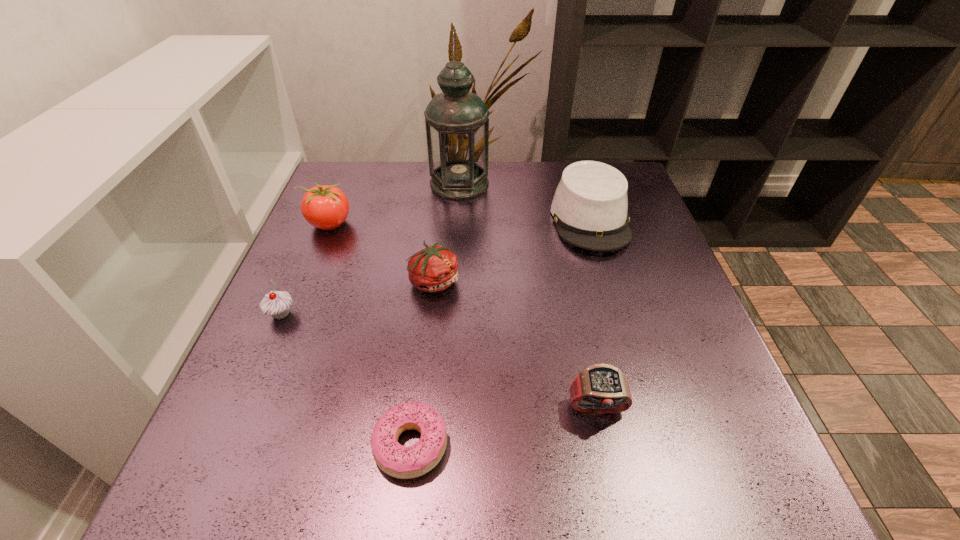
Where is `free space between the watch and the doughnut`? free space between the watch and the doughnut is located at coordinates (504, 427).

Where is `empty space between the doughnut and the nearer tomato`? Image resolution: width=960 pixels, height=540 pixels. empty space between the doughnut and the nearer tomato is located at coordinates (422, 363).

This screenshot has height=540, width=960. I want to click on free area in between the hat and the tallest object, so click(x=525, y=201).

Identify the location of empty space between the watch and the nearer tomato. The width and height of the screenshot is (960, 540). (516, 345).

Where is `free space between the tallest object and the fourth nearest object`? The width and height of the screenshot is (960, 540). free space between the tallest object and the fourth nearest object is located at coordinates (447, 232).

Identify the location of free area in between the hat and the tallest object. The image size is (960, 540). (525, 201).

Where is `free spot between the hat and the shortest object`? Image resolution: width=960 pixels, height=540 pixels. free spot between the hat and the shortest object is located at coordinates (500, 332).

The height and width of the screenshot is (540, 960). Find the location of `object that can be found as the third closest to the farther tomato`. object that can be found as the third closest to the farther tomato is located at coordinates (277, 304).

Find the location of a particular element. object that is the fifth closest to the hat is located at coordinates (326, 207).

I want to click on vacant region that satisfies the following two spatial constraints: 1. on the back side of the third nearest object; 2. on the right side of the taller tomato, so click(x=320, y=224).